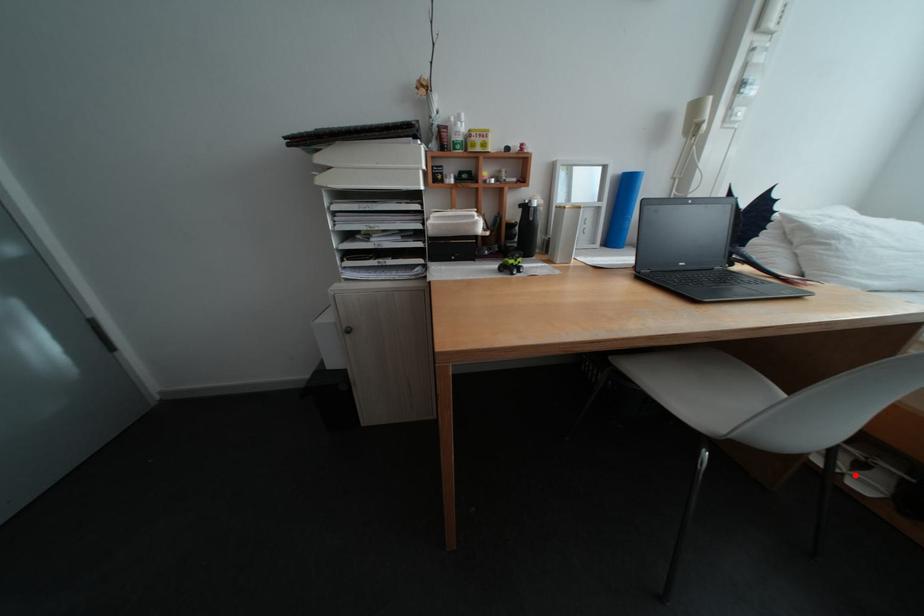
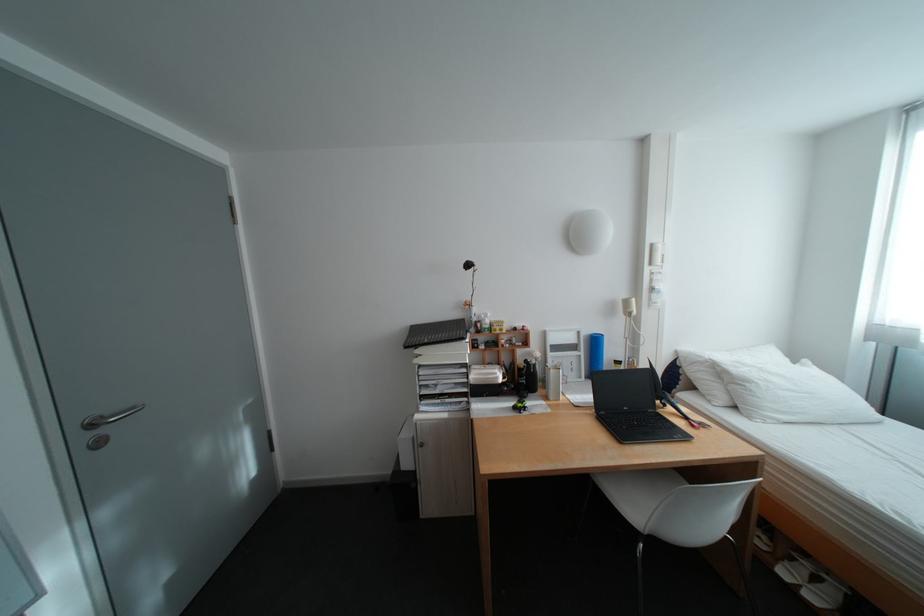
Where in the second image is the point corresponding to the highlighted location from the first image?

(813, 586)